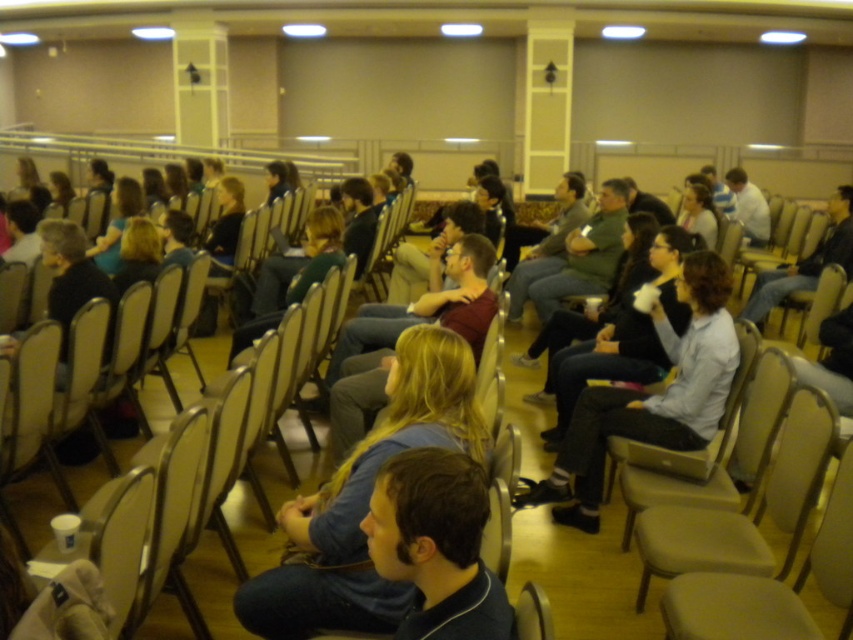
Question: Does light brown leather jacket at center right lie in front of light brown leather jacket at center?

Choices:
 (A) no
 (B) yes

Answer: (B)

Question: Which is nearer to the beige fabric chair at lower right?

Choices:
 (A) dark blue shirt at center
 (B) light brown leather jacket at center right
 (C) light gray fabric jacket at center

Answer: (A)

Question: Can you confirm if beige fabric chair at lower right is positioned to the left of light brown leather jacket at center right?

Choices:
 (A) yes
 (B) no

Answer: (A)

Question: Which of the following is the farthest from the observer?

Choices:
 (A) (846, 504)
 (B) (850, 252)

Answer: (B)

Question: Which point is farther to the camera?

Choices:
 (A) light brown leather jacket at center right
 (B) light gray fabric jacket at center

Answer: (A)

Question: Can you confirm if light brown leather jacket at center right is wider than blonde hair at center?

Choices:
 (A) yes
 (B) no

Answer: (A)